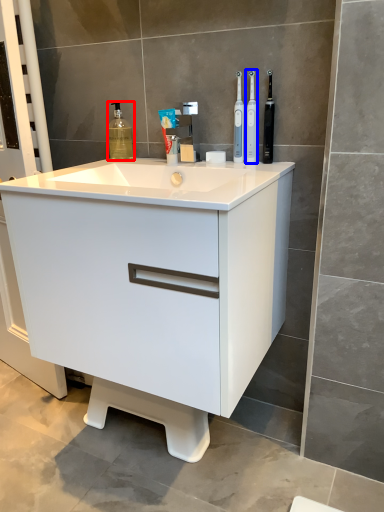
Question: Among these objects, which one is farthest to the camera, cleaning product (highlighted by a red box) or toothbrush (highlighted by a blue box)?

Choices:
 (A) cleaning product
 (B) toothbrush

Answer: (A)